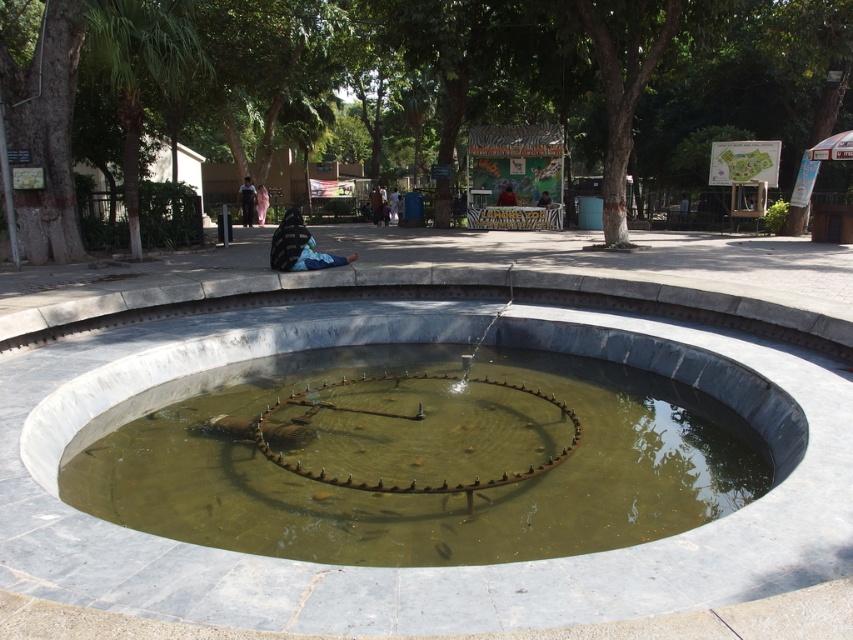
Question: Is greenish concrete water at center thinner than light brown fabric shirt at center?

Choices:
 (A) no
 (B) yes

Answer: (A)

Question: Which object is positioned farthest from the light brown fabric shirt at center?

Choices:
 (A) brown bark tree at center
 (B) greenish concrete water at center

Answer: (B)

Question: Is greenish concrete water at center positioned at the back of light brown fabric shirt at center?

Choices:
 (A) no
 (B) yes

Answer: (A)

Question: Which object is farther from the camera taking this photo?

Choices:
 (A) brown bark tree at center
 (B) greenish concrete water at center
 (C) light brown fabric shirt at center

Answer: (C)

Question: Does brown bark tree at center appear on the left side of light brown fabric shirt at center?

Choices:
 (A) yes
 (B) no

Answer: (B)

Question: Based on their relative distances, which object is nearer to the brown bark tree at center?

Choices:
 (A) light brown fabric shirt at center
 (B) greenish concrete water at center

Answer: (A)